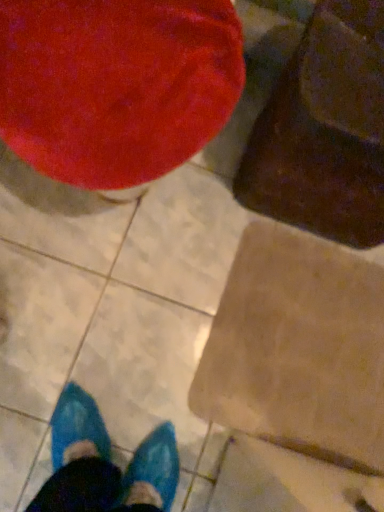
Where is `vacant region below brown cardboard at lower right (from a real-world perspective)`? The image size is (384, 512). vacant region below brown cardboard at lower right (from a real-world perspective) is located at coordinates (302, 341).